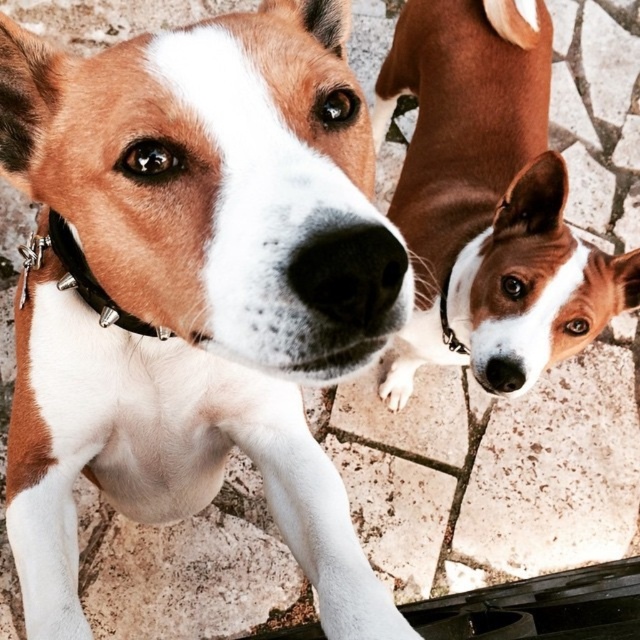
The image size is (640, 640). Describe the element at coordinates (195, 289) in the screenshot. I see `brown and white fur at center` at that location.

Is brown and white fur at center thinner than black rubber nose at upper center?

No.

Which is behind, point (228, 310) or point (499, 381)?

Positioned behind is point (499, 381).

Find the location of a particular element. The height and width of the screenshot is (640, 640). brown and white fur at center is located at coordinates (195, 289).

Based on the photo, does brown/white fur dog at upper right have a greater width compared to black rubber nose at upper center?

Correct, the width of brown/white fur dog at upper right exceeds that of black rubber nose at upper center.

Can you confirm if brown/white fur dog at upper right is bigger than black rubber nose at upper center?

Correct, brown/white fur dog at upper right is larger in size than black rubber nose at upper center.

Describe the element at coordinates (490, 192) in the screenshot. I see `brown/white fur dog at upper right` at that location.

The height and width of the screenshot is (640, 640). In order to click on brown/white fur dog at upper right in this screenshot , I will do `click(490, 192)`.

Can you confirm if black studded leather at center is taller than black rubber nose at upper center?

Yes.

Can you confirm if black studded leather at center is thinner than black rubber nose at upper center?

No.

Who is more forward, [51,232] or [492,356]?

Point [51,232]

Where is `black studded leather at center`? The width and height of the screenshot is (640, 640). black studded leather at center is located at coordinates (92, 282).